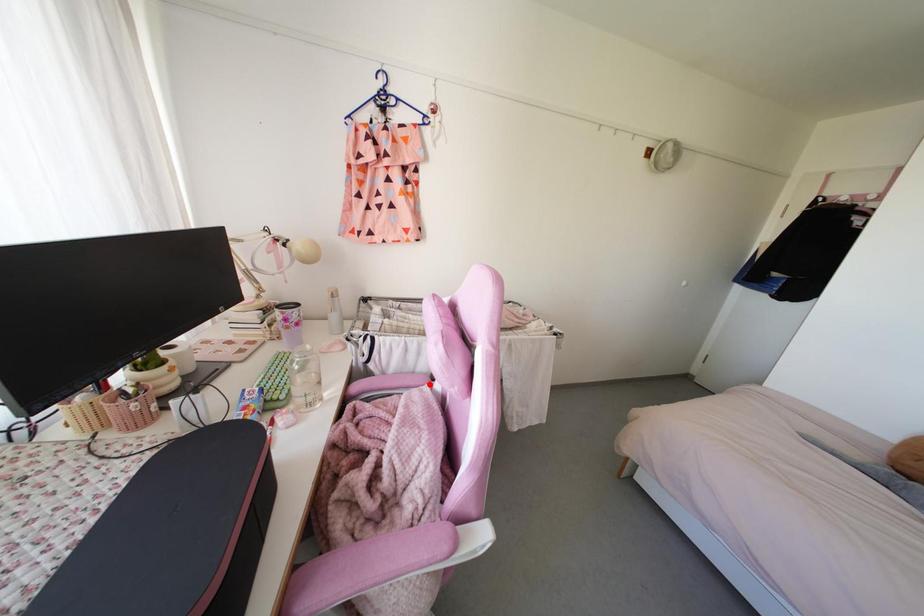
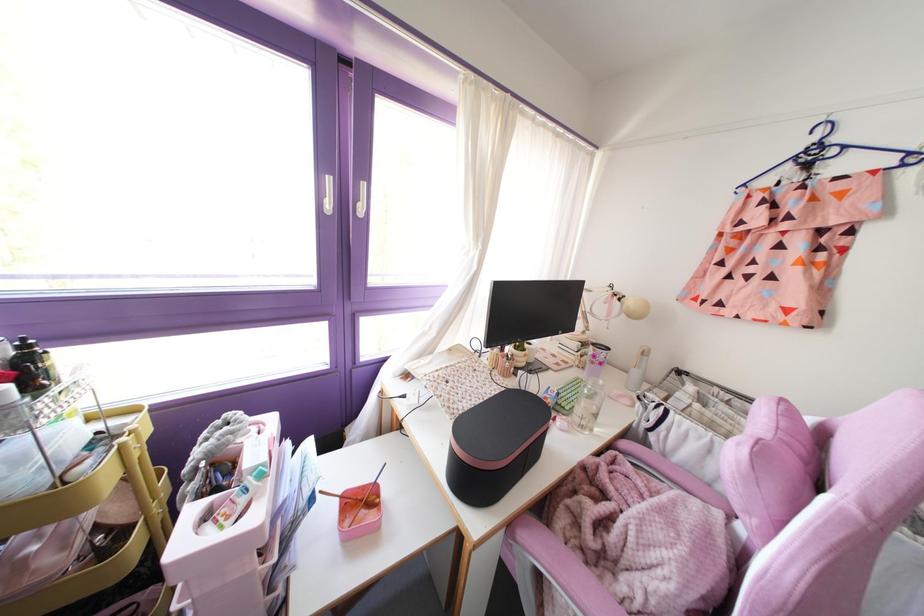
The point at the highlighted location is marked in the first image. Where is the corresponding point in the second image?

(727, 517)